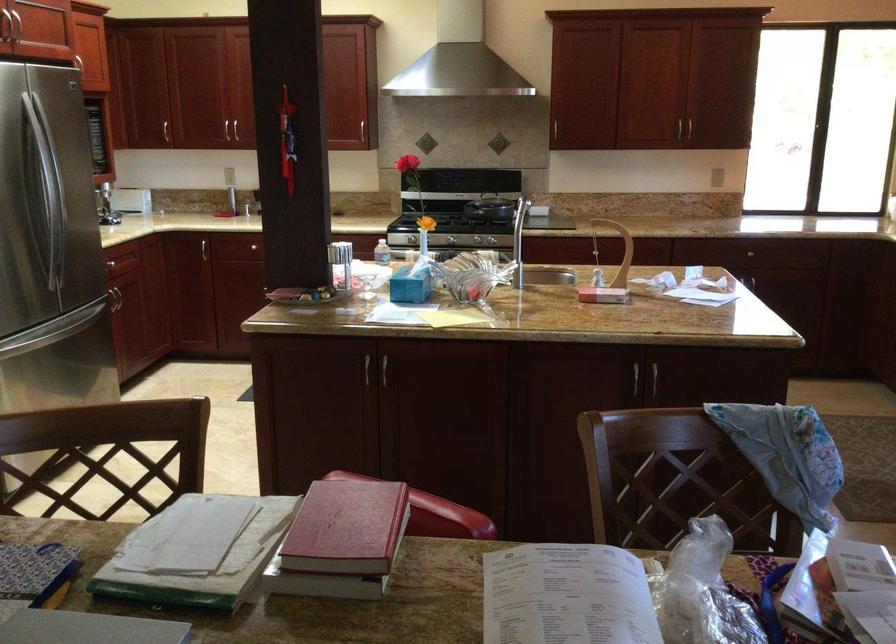
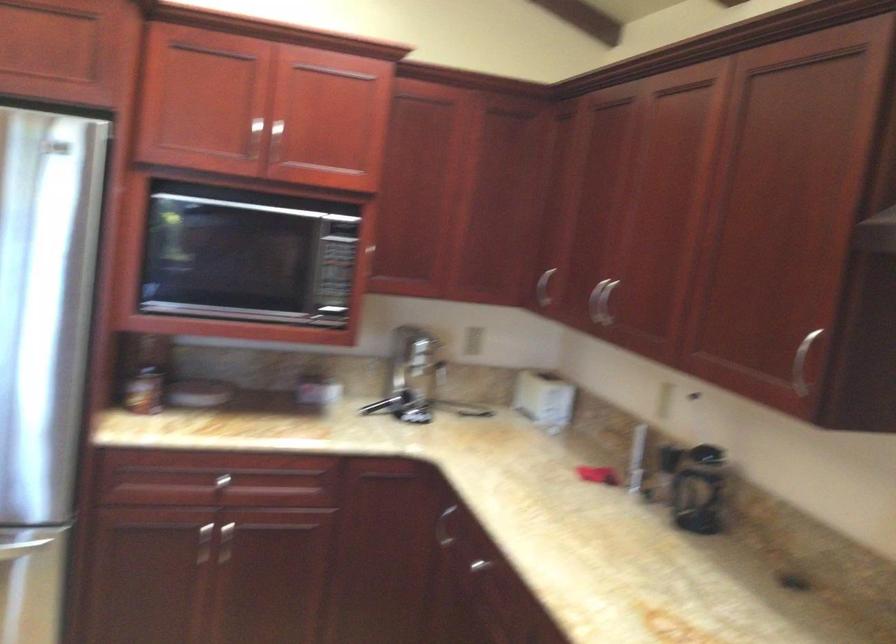
In the second image, find the point that corresponds to pixel 227 234 in the first image.

(495, 567)